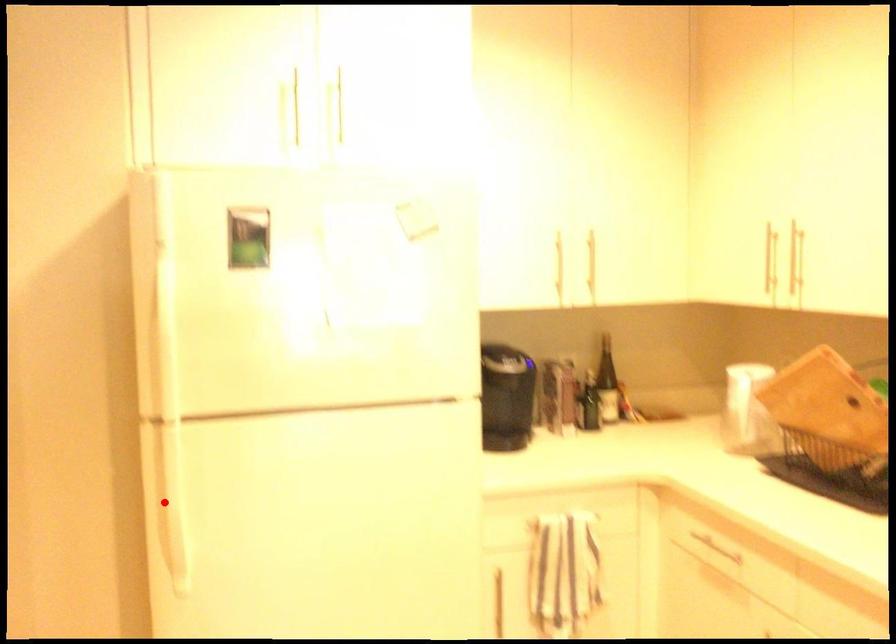
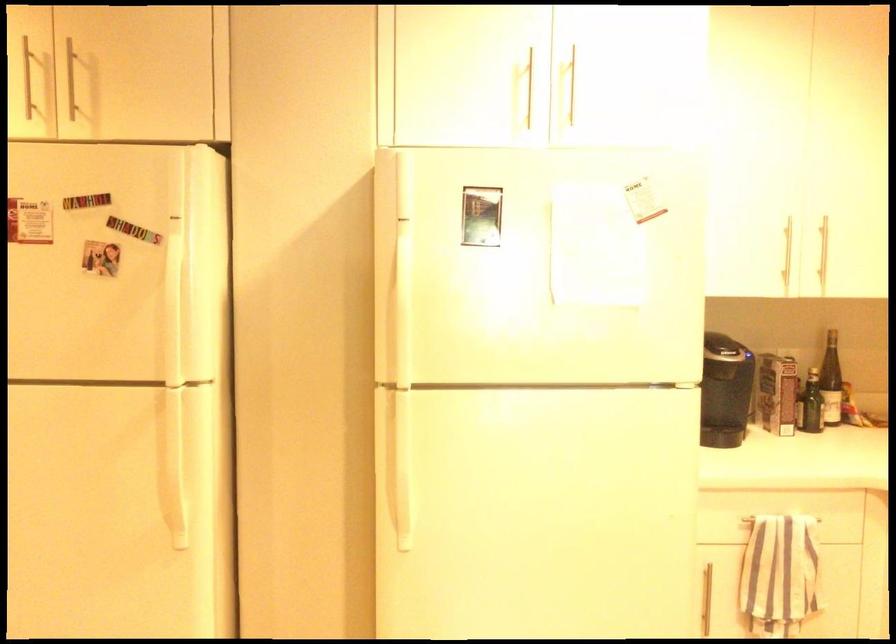
The point at the highlighted location is marked in the first image. Where is the corresponding point in the second image?

(398, 460)